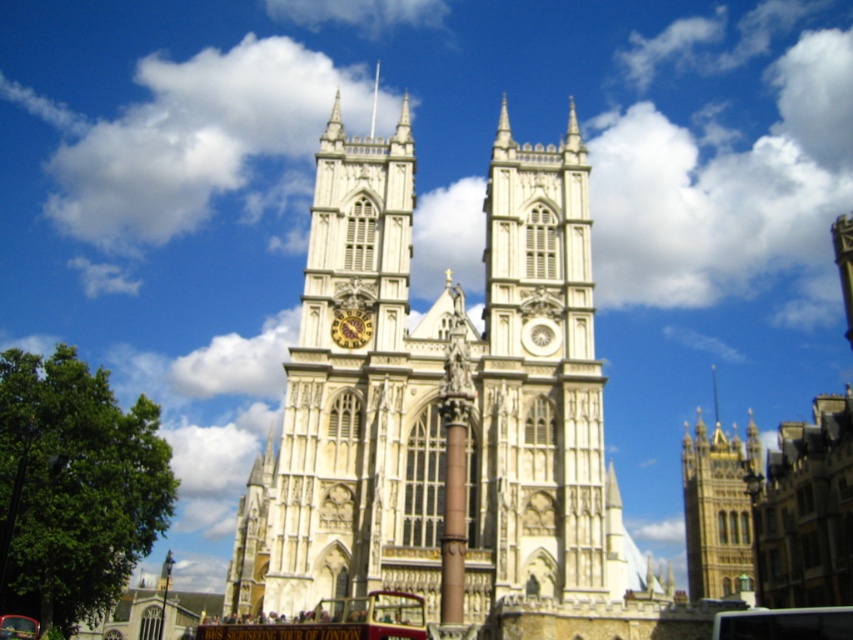
Is white stone church at center to the left of gold textured clock at center from the viewer's perspective?

No, white stone church at center is not to the left of gold textured clock at center.

Is point (334, 157) closer to viewer compared to point (338, 316)?

No, (334, 157) is further to viewer.

Is point (300, 589) in front of point (345, 323)?

Yes, it is.

Where is `white stone church at center`? white stone church at center is located at coordinates (440, 404).

Which is behind, point (595, 593) or point (335, 561)?

Positioned behind is point (335, 561).

Which is more to the left, white stone church at center or white stone clock tower at center?

white stone clock tower at center is more to the left.

This screenshot has width=853, height=640. I want to click on white stone church at center, so click(x=440, y=404).

Who is more distant from viewer, (x=387, y=182) or (x=335, y=320)?

The point (x=387, y=182) is more distant.

Is white stone clock tower at center further to the viewer compared to gold textured clock at center?

No.

Does point (302, 368) lie behind point (357, 340)?

No.

Where is `white stone clock tower at center`? white stone clock tower at center is located at coordinates (345, 378).